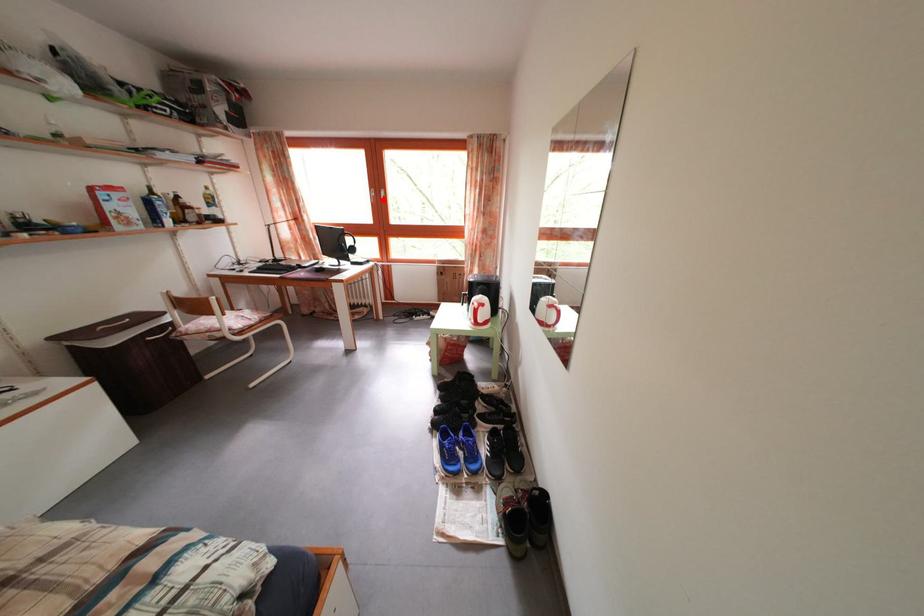
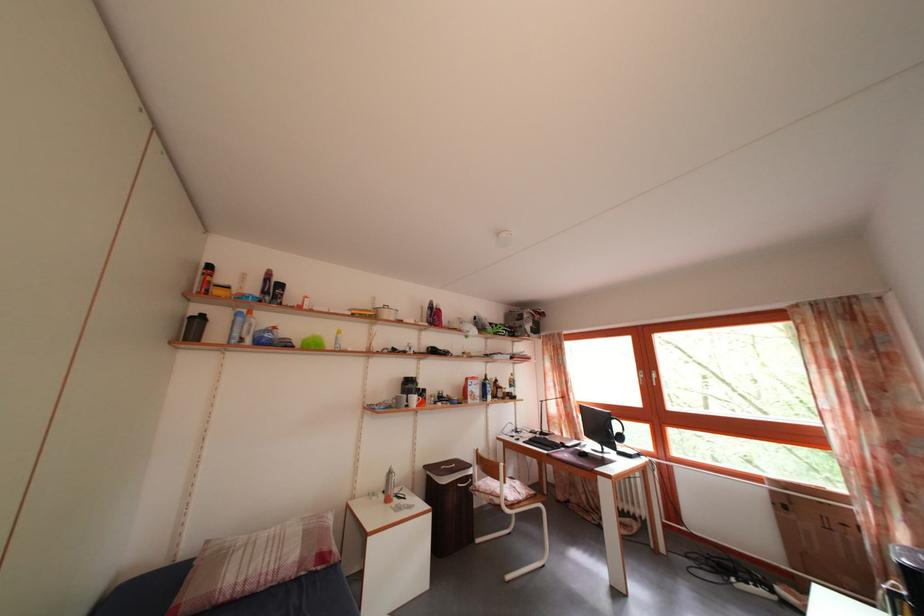
Question: A red point is marked in image1. In image2, is the corresponding 3D point closer to the camera or farther? Reply with the corresponding letter.

Choices:
 (A) The corresponding 3D point is closer.
 (B) The corresponding 3D point is farther.

Answer: (B)